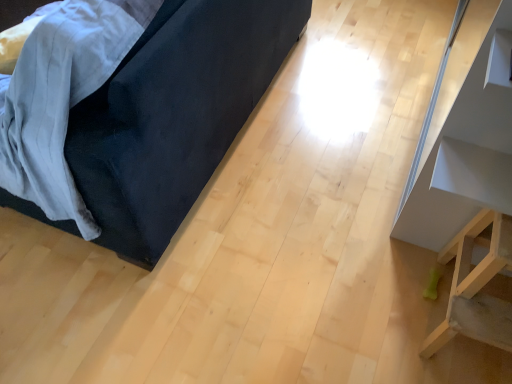
Question: Considering the relative sizes of white glossy shelf at upper right, positioned as the 1th furniture in right-to-left order, and light wood stool at lower right, the second furniture from the left, in the image provided, is white glossy shelf at upper right, positioned as the 1th furniture in right-to-left order, thinner than light wood stool at lower right, the second furniture from the left,?

Choices:
 (A) yes
 (B) no

Answer: (A)

Question: Is white glossy shelf at upper right, positioned as the 1th furniture in right-to-left order, not close to light wood stool at lower right, the second furniture viewed from the right?

Choices:
 (A) yes
 (B) no

Answer: (B)

Question: Does white glossy shelf at upper right, positioned as the 1th furniture in right-to-left order, have a greater width compared to light wood stool at lower right, the second furniture viewed from the right?

Choices:
 (A) no
 (B) yes

Answer: (A)

Question: From the image's perspective, is white glossy shelf at upper right, marked as the 3th furniture in a left-to-right arrangement, located above light wood stool at lower right, the second furniture from the left?

Choices:
 (A) no
 (B) yes

Answer: (B)

Question: Does white glossy shelf at upper right, marked as the 3th furniture in a left-to-right arrangement, have a greater height compared to light wood stool at lower right, the second furniture from the left?

Choices:
 (A) no
 (B) yes

Answer: (B)

Question: From a real-world perspective, is light wood stool at lower right, the second furniture viewed from the right, positioned above or below white glossy shelf at upper right, marked as the 3th furniture in a left-to-right arrangement?

Choices:
 (A) above
 (B) below

Answer: (B)

Question: In terms of size, does light wood stool at lower right, the second furniture viewed from the right, appear bigger or smaller than white glossy shelf at upper right, positioned as the 1th furniture in right-to-left order?

Choices:
 (A) small
 (B) big

Answer: (A)

Question: Is light wood stool at lower right, the second furniture viewed from the right, to the left or to the right of white glossy shelf at upper right, positioned as the 1th furniture in right-to-left order, in the image?

Choices:
 (A) left
 (B) right

Answer: (A)

Question: In terms of height, does light wood stool at lower right, the second furniture from the left, look taller or shorter compared to white glossy shelf at upper right, positioned as the 1th furniture in right-to-left order?

Choices:
 (A) short
 (B) tall

Answer: (A)

Question: Looking at their shapes, would you say velvet dark blue couch at left, the first furniture when ordered from left to right, is wider or thinner than white glossy shelf at upper right, marked as the 3th furniture in a left-to-right arrangement?

Choices:
 (A) wide
 (B) thin

Answer: (A)

Question: Is velvet dark blue couch at left, the first furniture when ordered from left to right, inside or outside of white glossy shelf at upper right, marked as the 3th furniture in a left-to-right arrangement?

Choices:
 (A) inside
 (B) outside

Answer: (B)

Question: Considering the relative positions of velvet dark blue couch at left, placed as the 3th furniture when sorted from right to left, and white glossy shelf at upper right, positioned as the 1th furniture in right-to-left order, in the image provided, is velvet dark blue couch at left, placed as the 3th furniture when sorted from right to left, to the left or to the right of white glossy shelf at upper right, positioned as the 1th furniture in right-to-left order,?

Choices:
 (A) right
 (B) left

Answer: (B)

Question: In terms of height, does velvet dark blue couch at left, placed as the 3th furniture when sorted from right to left, look taller or shorter compared to white glossy shelf at upper right, marked as the 3th furniture in a left-to-right arrangement?

Choices:
 (A) short
 (B) tall

Answer: (A)

Question: From their relative heights in the image, would you say white glossy shelf at upper right, marked as the 3th furniture in a left-to-right arrangement, is taller or shorter than light wood stool at lower right, the second furniture viewed from the right?

Choices:
 (A) short
 (B) tall

Answer: (B)

Question: Is white glossy shelf at upper right, positioned as the 1th furniture in right-to-left order, bigger or smaller than light wood stool at lower right, the second furniture from the left?

Choices:
 (A) small
 (B) big

Answer: (B)